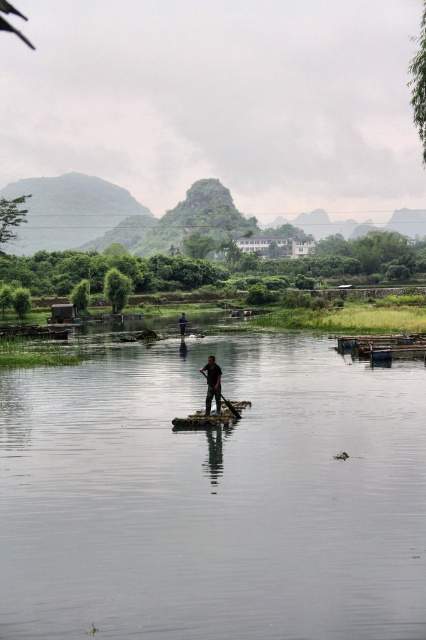
This screenshot has width=426, height=640. I want to click on clear water at center, so click(x=213, y=497).

Is clear water at center smaller than dark green fabric at center?

No, clear water at center is not smaller than dark green fabric at center.

Locate an element on the screen. clear water at center is located at coordinates (213, 497).

Who is more forward, [362,627] or [224,401]?

Point [362,627] is in front.

Who is positioned more to the right, clear water at center or wooden raft at center?

Positioned to the right is clear water at center.

Is point (279, 508) positioned behind point (249, 401)?

No, (279, 508) is in front of (249, 401).

You are a GUI agent. You are given a task and a screenshot of the screen. Output one action in this format:
    pyautogui.click(x=<x>, y=<y>)
    Task: Click on the clear water at center
    
    Given the screenshot: What is the action you would take?
    pyautogui.click(x=213, y=497)

The width and height of the screenshot is (426, 640). Describe the element at coordinates (230, 406) in the screenshot. I see `wooden paddle at center` at that location.

Which is in front, point (236, 417) or point (184, 316)?

Positioned in front is point (236, 417).

The width and height of the screenshot is (426, 640). Find the location of `wooden paddle at center`. wooden paddle at center is located at coordinates (230, 406).

Identify the location of wooden paddle at center. (230, 406).